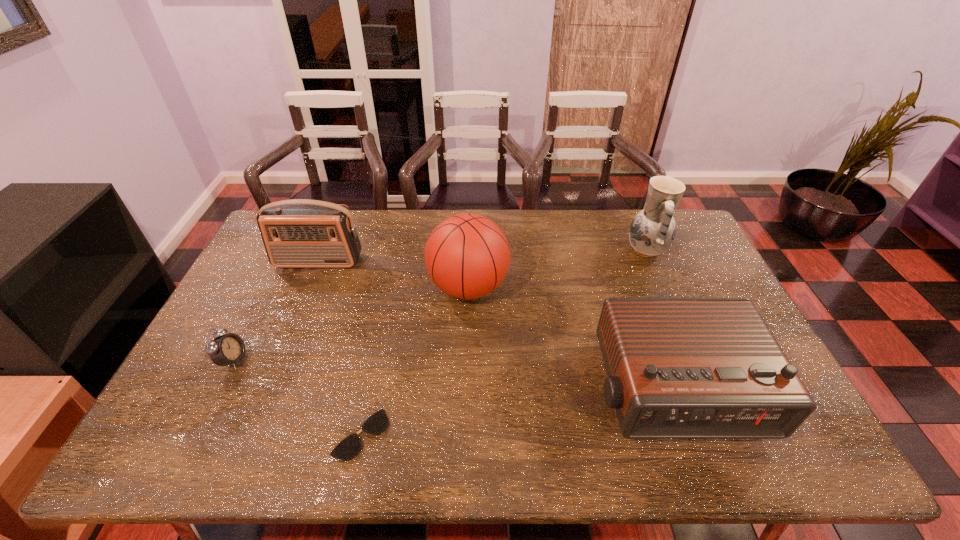
I want to click on free location located 0.250m on either side of the pottery, so click(553, 251).

Identify the location of blank space located on the left of the fourth object from left to right. The width and height of the screenshot is (960, 540). (391, 287).

What are the coordinates of `free location located 0.380m on the front-facing side of the left radio receiver` in the screenshot? It's located at (276, 366).

At what (x,y) coordinates should I click in order to perform the action: click on vacant space located on the face of the alarm clock. Please return your answer as a coordinate pair (x, y). Image resolution: width=960 pixels, height=540 pixels. Looking at the image, I should click on (301, 360).

You are a GUI agent. You are given a task and a screenshot of the screen. Output one action in this format:
    pyautogui.click(x=<x>, y=<y>)
    Task: Click on the vacant space located on the right of the spectacles
    This screenshot has height=540, width=960.
    Given the screenshot: What is the action you would take?
    pyautogui.click(x=434, y=434)

You are a GUI agent. You are given a task and a screenshot of the screen. Output one action in this format:
    pyautogui.click(x=<x>, y=<y>)
    Task: Click on the object that is at the far edge
    The width and height of the screenshot is (960, 540).
    Given the screenshot: What is the action you would take?
    pyautogui.click(x=652, y=231)

Image resolution: width=960 pixels, height=540 pixels. I want to click on radio receiver that is at the near edge, so click(677, 367).

The image size is (960, 540). Identify the location of spectacles that is at the near edge. (350, 446).

The image size is (960, 540). I want to click on radio receiver at the left edge, so click(299, 233).

Identify the location of alarm clock that is at the left edge. The image size is (960, 540). (223, 350).